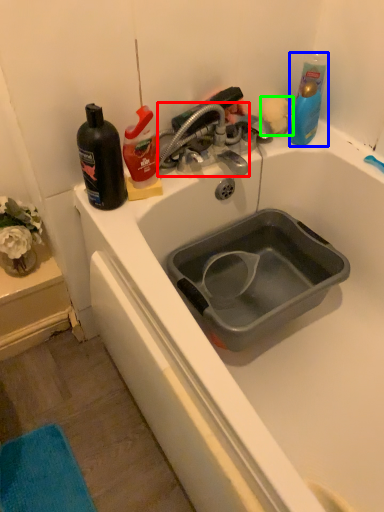
Question: Which object is the closest to the tap (highlighted by a red box)? Choose among these: cleaning product (highlighted by a blue box) or flower (highlighted by a green box).

Choices:
 (A) cleaning product
 (B) flower

Answer: (B)